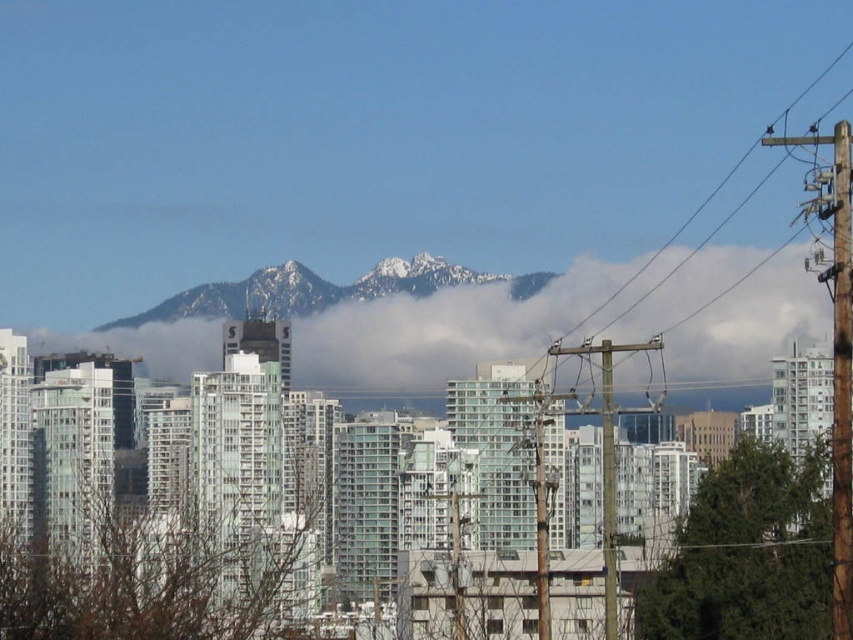
Question: Can you confirm if white fluffy cloud at center is positioned above snowy rocky mountain at center?

Choices:
 (A) yes
 (B) no

Answer: (B)

Question: Which point is farther from the camera taking this photo?

Choices:
 (A) (579, 276)
 (B) (234, 285)

Answer: (B)

Question: Among these points, which one is farthest from the camera?

Choices:
 (A) (718, 328)
 (B) (287, 285)

Answer: (A)

Question: Which object is closer to the camera taking this photo?

Choices:
 (A) white fluffy cloud at center
 (B) snowy rocky mountain at center

Answer: (B)

Question: Observing the image, what is the correct spatial positioning of white fluffy cloud at center in reference to snowy rocky mountain at center?

Choices:
 (A) left
 (B) right

Answer: (B)

Question: Is white fluffy cloud at center thinner than snowy rocky mountain at center?

Choices:
 (A) yes
 (B) no

Answer: (B)